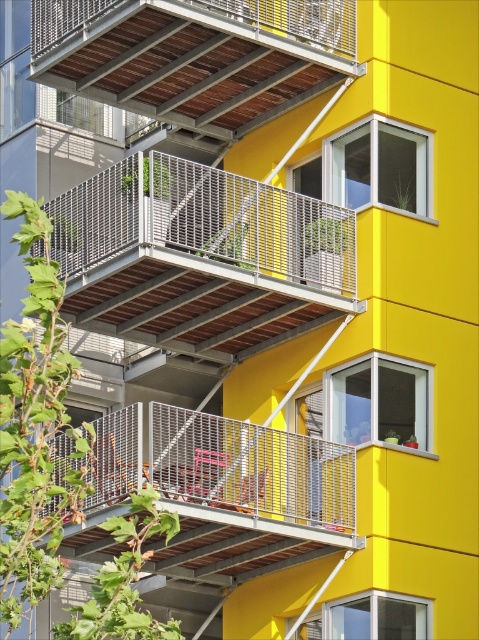
You are standing at the point with coordinates point (161, 45) and want to move towards the point with coordinates point (306, 248). Given the building layout described in the scene, will moving forward from your current position allow you to reach the target point?

Yes, because point (306, 248) is in front of point (161, 45), so moving forward from your current position will lead you directly towards it.

You are a window washer standing on the metallic brown balcony at upper center and want to reach the metallic gray balcony at center to clean its windows. Can you safely step from one balcony to the other based on their heights?

The metallic brown balcony at upper center has a lesser height compared to the metallic gray balcony at center. Since the metallic brown balcony is lower, you can safely step up to the higher metallic gray balcony at center.

You are a delivery drone trying to land on the metallic brown balcony at upper center. The landing coordinates must be within a 0.1 unit radius of the balcony. Can you land safely?

The metallic brown balcony at upper center is located at point coordinates (195, 54). Since the landing coordinates must be within a 0.1 unit radius, the drone can safely land there as the coordinates fall within the required range.